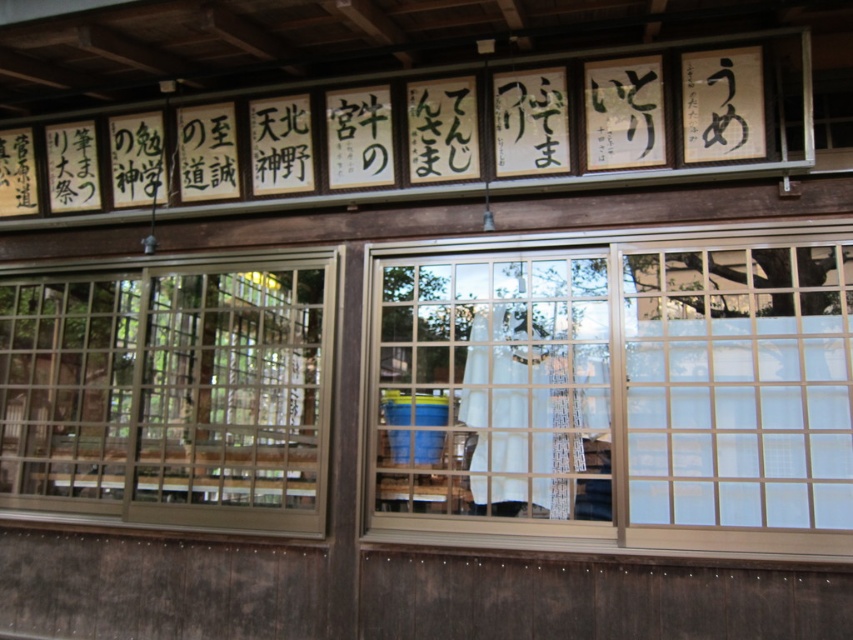
Question: Can you confirm if clear glass window at center is positioned to the right of clear glass window at left?

Choices:
 (A) no
 (B) yes

Answer: (B)

Question: Among these points, which one is nearest to the camera?

Choices:
 (A) (724, 515)
 (B) (4, 508)

Answer: (A)

Question: Can you confirm if clear glass window at center is positioned above clear glass window at left?

Choices:
 (A) no
 (B) yes

Answer: (B)

Question: Which point appears farthest from the camera in this image?

Choices:
 (A) (404, 484)
 (B) (169, 321)

Answer: (B)

Question: Which object appears farthest from the camera in this image?

Choices:
 (A) clear glass window at left
 (B) clear glass window at center

Answer: (A)

Question: From the image, what is the correct spatial relationship of clear glass window at center in relation to clear glass window at left?

Choices:
 (A) below
 (B) above

Answer: (B)